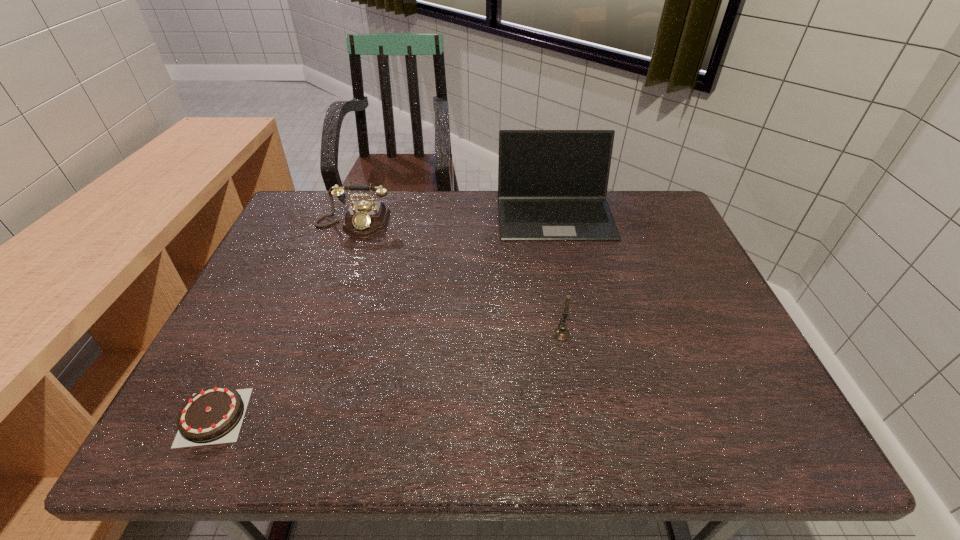
At what (x,y) coordinates should I click in order to perform the action: click on free space between the tallest object and the shortest object. Please return your answer as a coordinate pair (x, y). Looking at the image, I should click on point(384,315).

At what (x,y) coordinates should I click in order to perform the action: click on vacant region between the second nearest object and the tallest object. Please return your answer as a coordinate pair (x, y). Looking at the image, I should click on (558, 274).

Locate an element on the screen. object that is the second closest to the chocolate cake is located at coordinates (562, 334).

Locate which object is the third closest to the nearest object. Please provide its 2D coordinates. Your answer should be formatted as a tuple, i.e. [(x, y)], where the tuple contains the x and y coordinates of a point satisfying the conditions above.

[(552, 184)]

At what (x,y) coordinates should I click in order to perform the action: click on free spot that satisfies the following two spatial constraints: 1. on the dial of the telephone; 2. on the left side of the candle. Please return your answer as a coordinate pair (x, y). The image size is (960, 540). Looking at the image, I should click on (315, 335).

I want to click on vacant space that satisfies the following two spatial constraints: 1. on the dial of the third farthest object; 2. on the right side of the telephone, so click(315, 335).

The image size is (960, 540). What are the coordinates of `vacant position in the image that satisfies the following two spatial constraints: 1. on the dial of the telephone; 2. on the right side of the candle` in the screenshot? It's located at (315, 335).